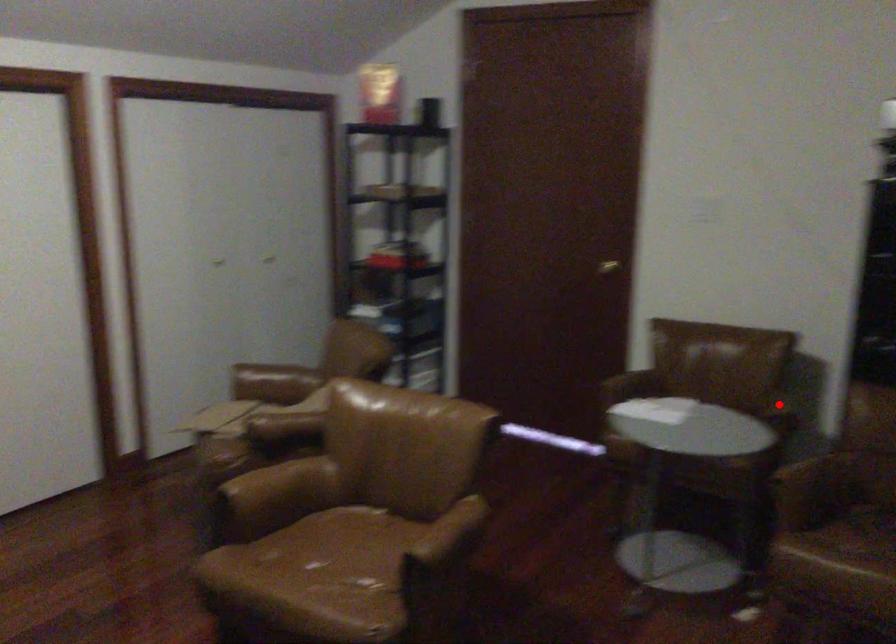
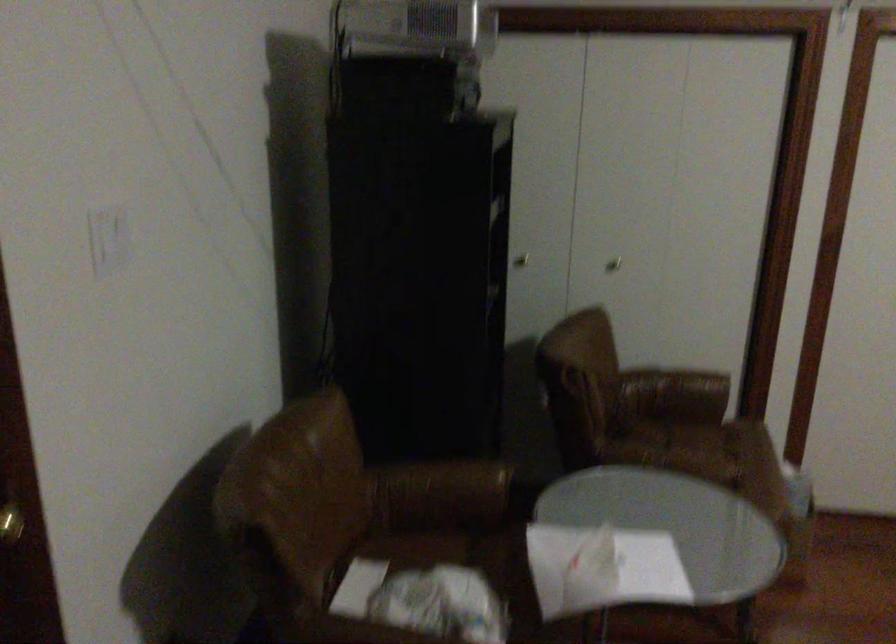
Where in the second image is the point corresponding to the highlighted location from the first image?

(442, 488)